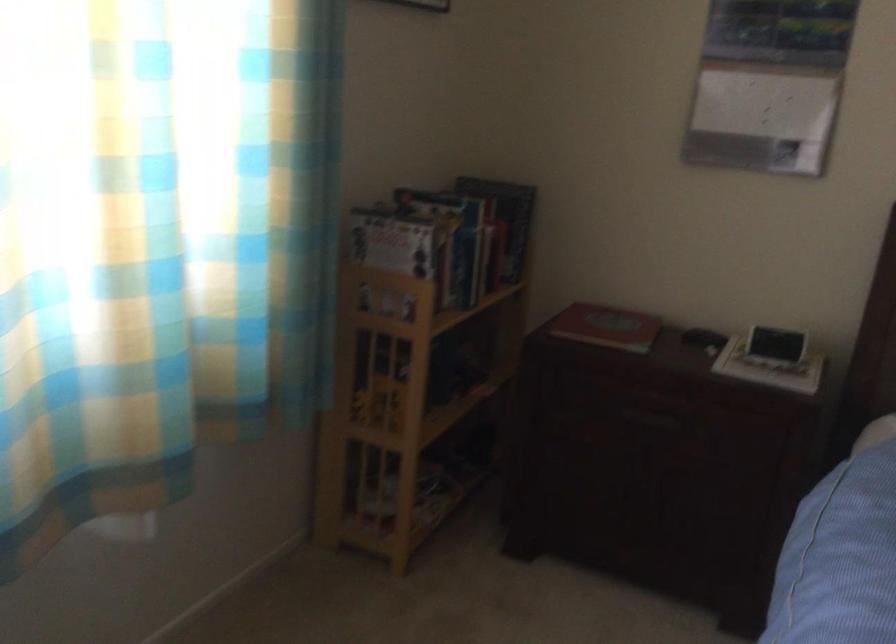
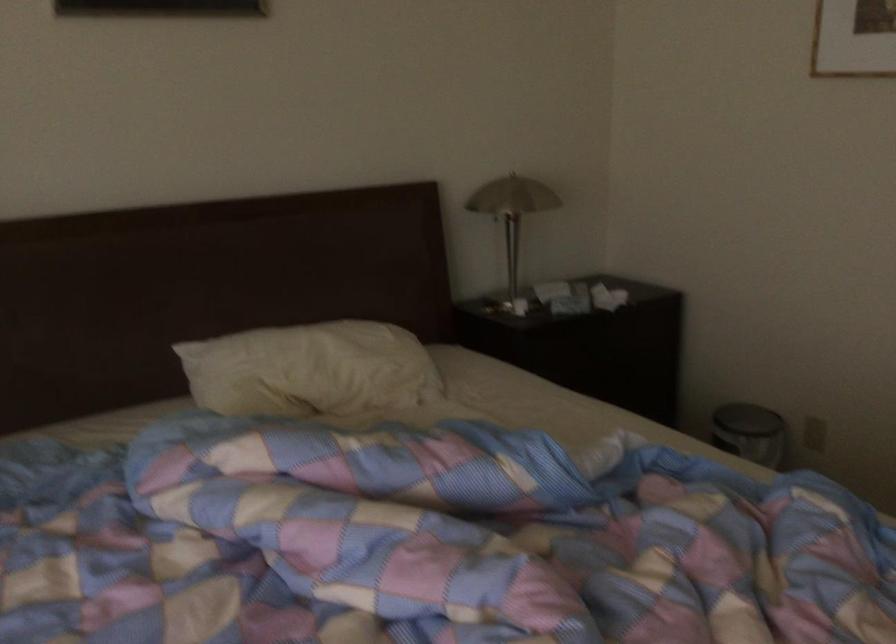
Question: The camera is either moving clockwise (left) or counter-clockwise (right) around the object. The first image is from the beginning of the video and the second image is from the end. Is the camera moving left or right when shooting the video?

Choices:
 (A) Left
 (B) Right

Answer: (A)